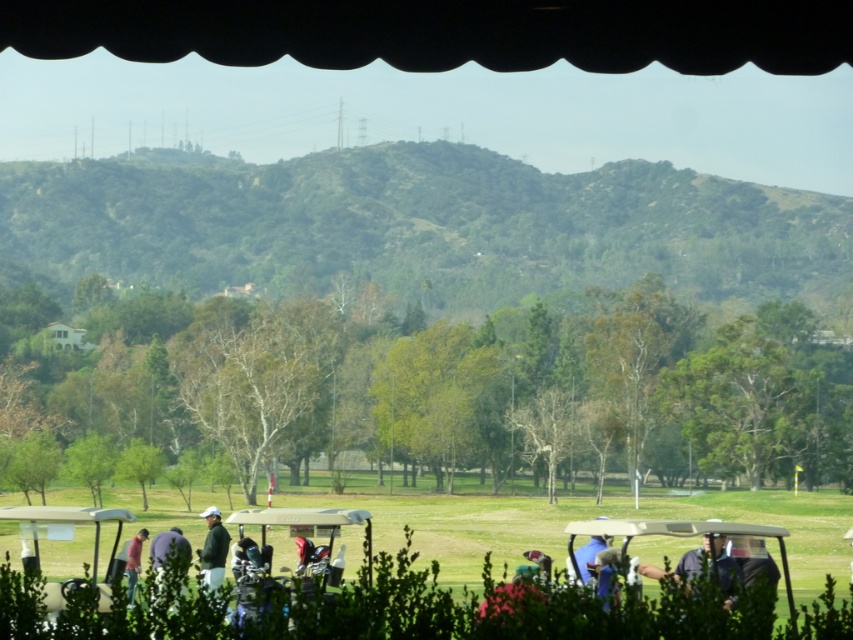
Between matte white golf cart at lower left and green fabric golf bag at center, which one is positioned lower?

matte white golf cart at lower left

Is matte white golf cart at lower left to the right of green fabric golf bag at center from the viewer's perspective?

No, matte white golf cart at lower left is not to the right of green fabric golf bag at center.

Which is in front, point (16, 509) or point (482, 609)?

Positioned in front is point (482, 609).

Find the location of `matte white golf cart at lower left`. matte white golf cart at lower left is located at coordinates (71, 522).

Between blue fabric shirt at lower right and green fabric golf bag at center, which one appears on the left side from the viewer's perspective?

Positioned to the left is green fabric golf bag at center.

Locate an element on the screen. The height and width of the screenshot is (640, 853). blue fabric shirt at lower right is located at coordinates (715, 563).

I want to click on blue fabric shirt at lower right, so click(715, 563).

Who is positioned more to the left, white plastic golf cart at center or pink fabric shirt at lower left?

Positioned to the left is pink fabric shirt at lower left.

Does white plastic golf cart at center have a smaller size compared to pink fabric shirt at lower left?

Yes.

This screenshot has height=640, width=853. What do you see at coordinates (682, 536) in the screenshot?
I see `white plastic golf cart at center` at bounding box center [682, 536].

This screenshot has width=853, height=640. Find the location of `white plastic golf cart at center`. white plastic golf cart at center is located at coordinates (682, 536).